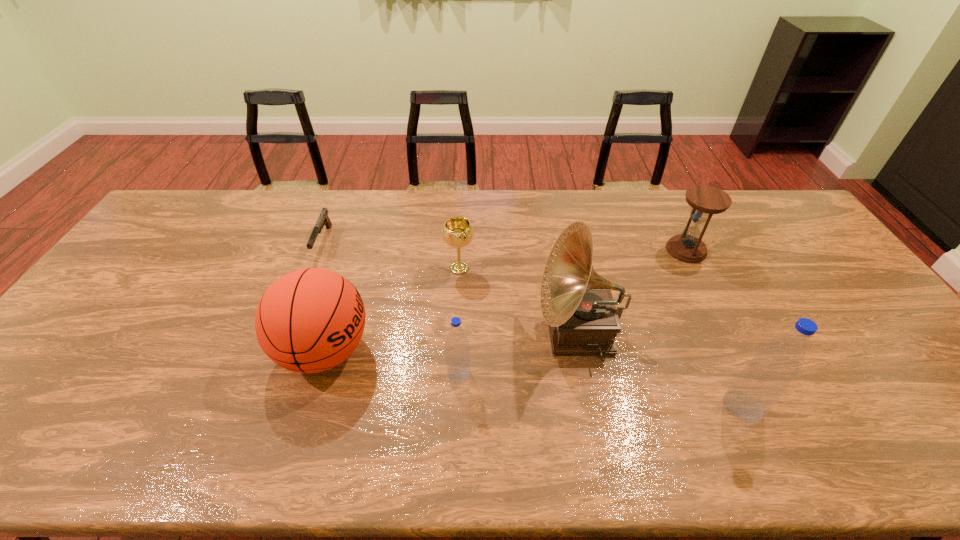
Locate an element on the screen. The width and height of the screenshot is (960, 540). vacant space that's between the shortest object and the fifth object from left to right is located at coordinates (451, 287).

This screenshot has height=540, width=960. I want to click on vacant point located between the third tallest object and the left water bottle, so click(392, 361).

This screenshot has height=540, width=960. What are the coordinates of `free point between the right water bottle and the phonograph record` in the screenshot? It's located at (660, 369).

At what (x,y) coordinates should I click in order to perform the action: click on object that is the nearest to the right water bottle. Please return your answer as a coordinate pair (x, y). The height and width of the screenshot is (540, 960). Looking at the image, I should click on (577, 304).

Point out which object is positioned as the fifth nearest to the right water bottle. Please provide its 2D coordinates. Your answer should be formatted as a tuple, i.e. [(x, y)], where the tuple contains the x and y coordinates of a point satisfying the conditions above.

[(310, 320)]

Locate an element on the screen. This screenshot has height=540, width=960. vacant space that satisfies the following two spatial constraints: 1. on the front side of the chalice; 2. on the left side of the farther water bottle is located at coordinates (454, 373).

This screenshot has height=540, width=960. Find the location of `vacant area in the image that satisfies the following two spatial constraints: 1. on the front side of the farther water bottle; 2. on the right side of the right water bottle`. vacant area in the image that satisfies the following two spatial constraints: 1. on the front side of the farther water bottle; 2. on the right side of the right water bottle is located at coordinates (457, 406).

Locate an element on the screen. This screenshot has height=540, width=960. free space in the image that satisfies the following two spatial constraints: 1. on the front side of the left water bottle; 2. on the left side of the sixth tallest object is located at coordinates [454, 373].

Find the location of `vacant space that satisfies the following two spatial constraints: 1. at the muzzle end of the shortest object; 2. on the right side of the taller water bottle`. vacant space that satisfies the following two spatial constraints: 1. at the muzzle end of the shortest object; 2. on the right side of the taller water bottle is located at coordinates (260, 406).

In order to click on free space that satisfies the following two spatial constraints: 1. on the back side of the left water bottle; 2. on the side with logo of the basketball in this screenshot , I will do `click(460, 350)`.